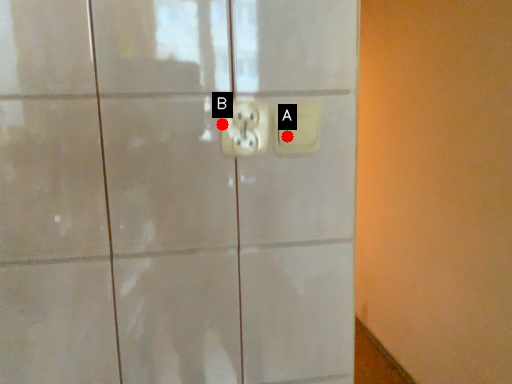
Question: Two points are circled on the image, labeled by A and B beside each circle. Which point appears closest to the camera in this image?

Choices:
 (A) A is closer
 (B) B is closer

Answer: (B)